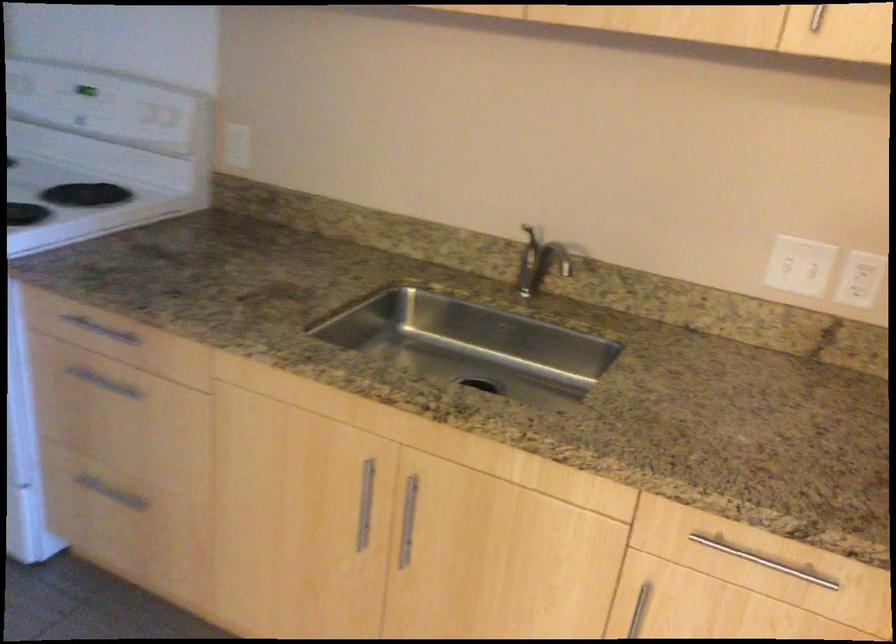
The width and height of the screenshot is (896, 644). What do you see at coordinates (408, 520) in the screenshot?
I see `a metal cabinet handle` at bounding box center [408, 520].